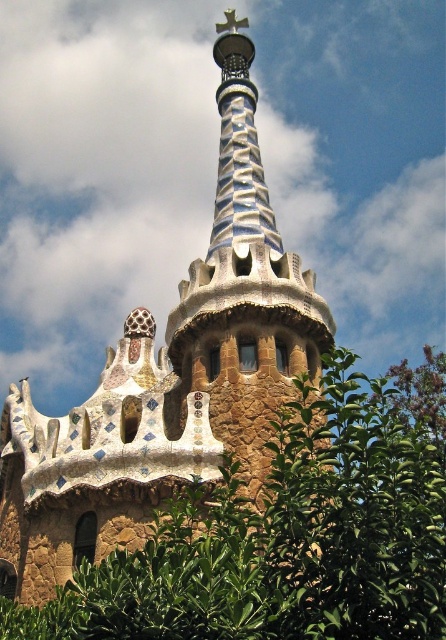
Does green leafy tree at center have a larger size compared to multicolored mosaic tower at center?

Indeed, green leafy tree at center has a larger size compared to multicolored mosaic tower at center.

Looking at this image, which of these two, green leafy tree at center or multicolored mosaic tower at center, stands taller?

multicolored mosaic tower at center is taller.

Is point (144, 602) in front of point (157, 486)?

Yes, it is in front of point (157, 486).

Find the location of a particular element. The height and width of the screenshot is (640, 446). green leafy tree at center is located at coordinates (289, 531).